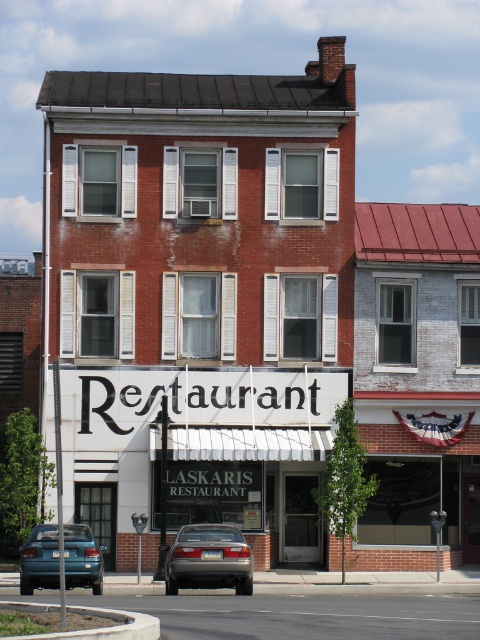
Question: Which point is closer to the camera taking this photo?

Choices:
 (A) (200, 563)
 (B) (86, 544)

Answer: (A)

Question: Which point is farther to the camera?

Choices:
 (A) (45, 572)
 (B) (165, 584)

Answer: (B)

Question: Does satin silver sedan at center appear on the left side of teal matte car at lower left?

Choices:
 (A) yes
 (B) no

Answer: (B)

Question: Is satin silver sedan at center below teal matte car at lower left?

Choices:
 (A) yes
 (B) no

Answer: (A)

Question: Can you confirm if satin silver sedan at center is bigger than teal matte car at lower left?

Choices:
 (A) no
 (B) yes

Answer: (B)